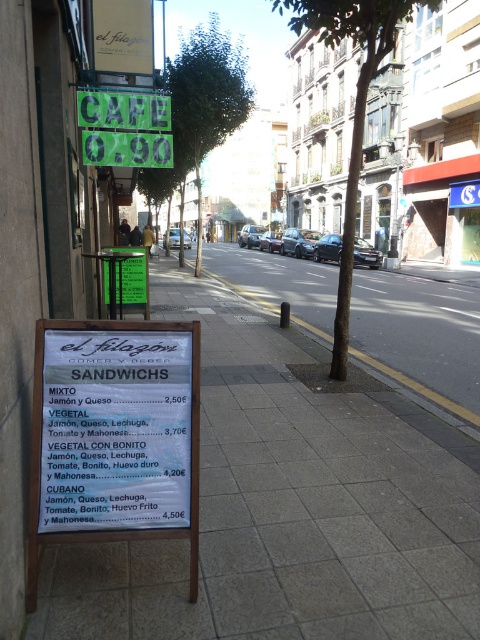
You are a tourist in Spain and see the green leafy tree at upper center and the green plastic sign at upper center. Which one is wider?

The green leafy tree at upper center is wider than the green plastic sign at upper center.

You are a tourist in Spain and want to order a Cubano sandwich from the menu board. You notice two points on the menu board at coordinates point [52,360] and point [219,84]. Which point is closer to you?

Point [52,360] is closer to the camera than point [219,84], so the point [52,360] is closer to you.

You are a delivery person with a 1.2 meter wide cart. You need to navigate through the street scene shown in the image. Can your cart fit through the space between the white tile pavement at lower center and the green leafy tree at center?

The white tile pavement at lower center has a lesser width compared to the green leafy tree at center, so the space between them may be narrow. However, since the exact width isn not provided, it is uncertain if the 1.2 meter wide cart can fit through. Please check the actual space before proceeding.